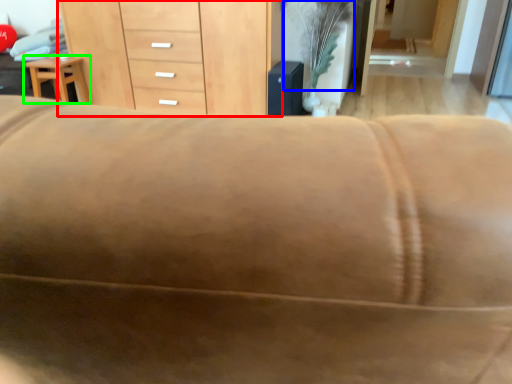
Question: Estimate the real-world distances between objects in this image. Which object is farther from chest of drawers (highlighted by a red box), plant (highlighted by a blue box) or furniture (highlighted by a green box)?

Choices:
 (A) plant
 (B) furniture

Answer: (A)